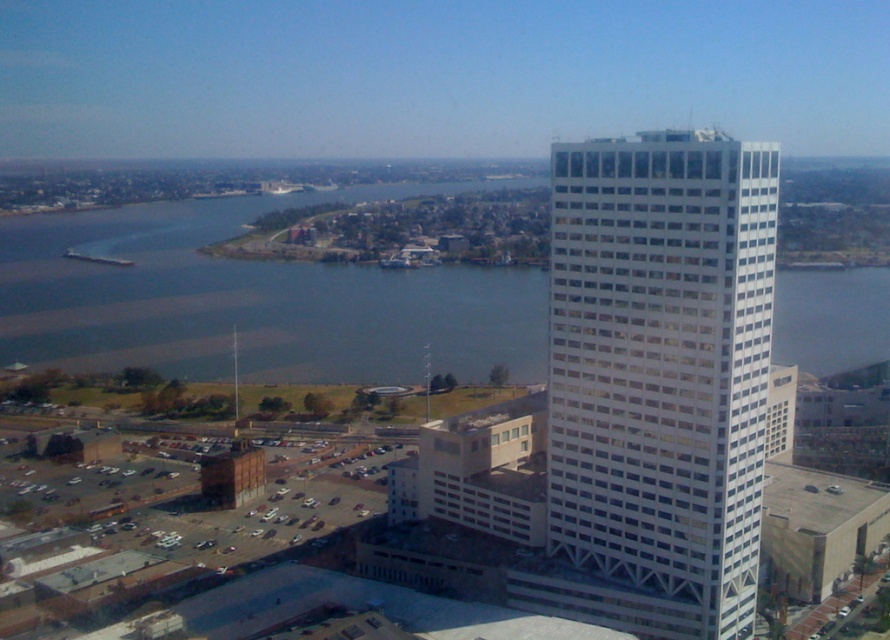
Looking at this image, can you confirm if white glass building at upper right is positioned to the left of blue water at center?

In fact, white glass building at upper right is to the right of blue water at center.

Is white glass building at upper right above blue water at center?

No.

Where is `white glass building at upper right`? Image resolution: width=890 pixels, height=640 pixels. white glass building at upper right is located at coordinates (662, 362).